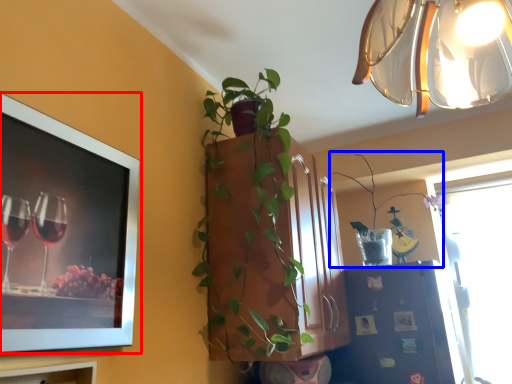
Question: Which object appears closest to the camera in this image, picture frame (highlighted by a red box) or houseplant (highlighted by a blue box)?

Choices:
 (A) picture frame
 (B) houseplant

Answer: (A)